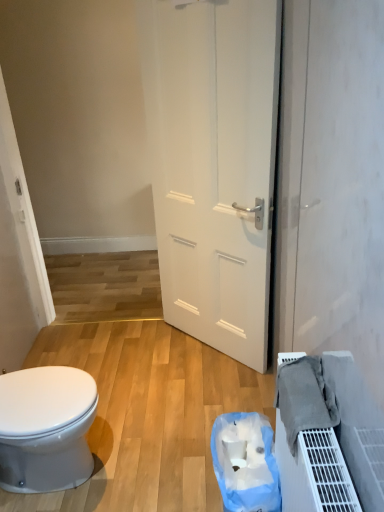
What are the coordinates of `vacant point to the right of white glossy bidet at lower left` in the screenshot? It's located at (147, 450).